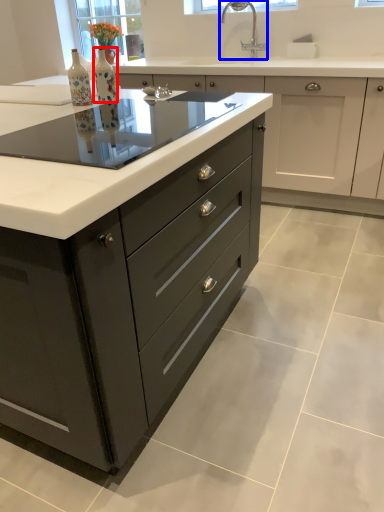
Question: Which object appears closest to the camera in this image, bottle (highlighted by a red box) or tap (highlighted by a blue box)?

Choices:
 (A) bottle
 (B) tap

Answer: (A)